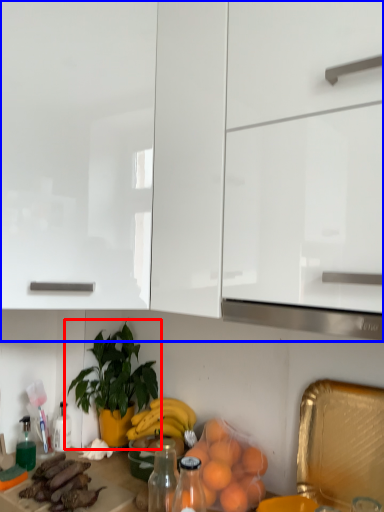
Question: Which object appears farthest to the camera in this image, houseplant (highlighted by a red box) or cabinetry (highlighted by a blue box)?

Choices:
 (A) houseplant
 (B) cabinetry

Answer: (A)